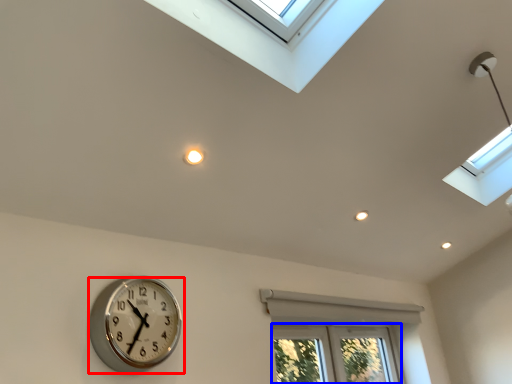
Question: Which object is closer to the camera taking this photo, wall clock (highlighted by a red box) or bay window (highlighted by a blue box)?

Choices:
 (A) wall clock
 (B) bay window

Answer: (A)